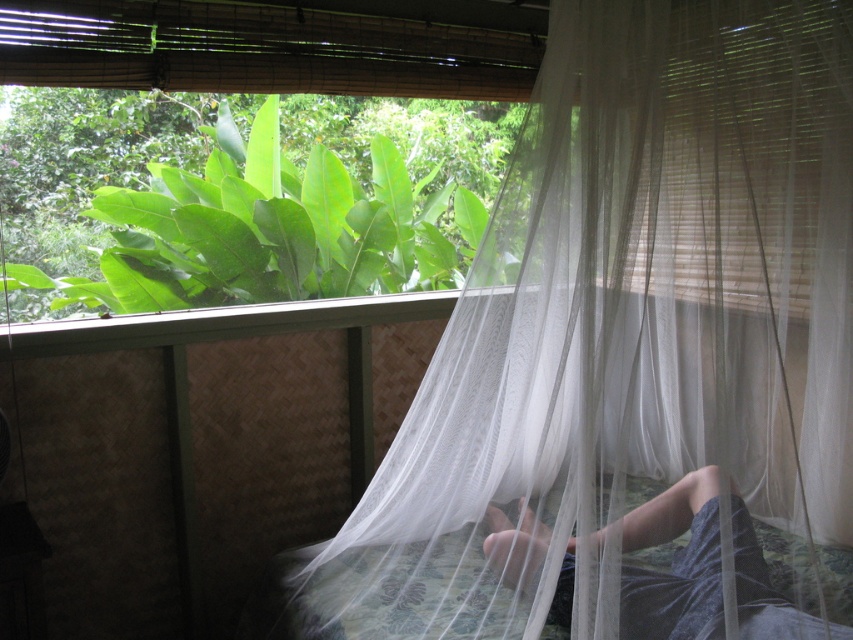
Between white sheer curtain at center and dark blue fabric at lower center, which one is positioned higher?

white sheer curtain at center is higher up.

Does white sheer curtain at center appear over dark blue fabric at lower center?

Yes, white sheer curtain at center is above dark blue fabric at lower center.

Is point (671, 19) less distant than point (527, 522)?

Yes, point (671, 19) is closer to viewer.

Identify the location of white sheer curtain at center. (635, 356).